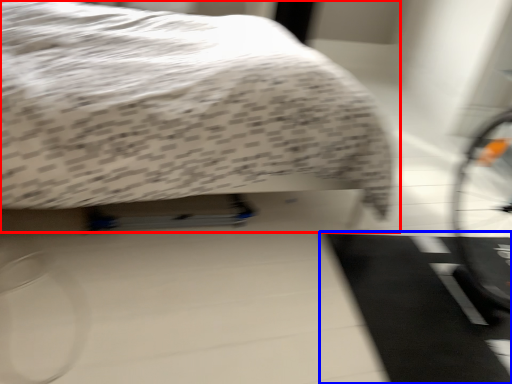
Question: Which of the following is the closest to the observer, bed (highlighted by a red box) or doormat (highlighted by a blue box)?

Choices:
 (A) bed
 (B) doormat

Answer: (A)